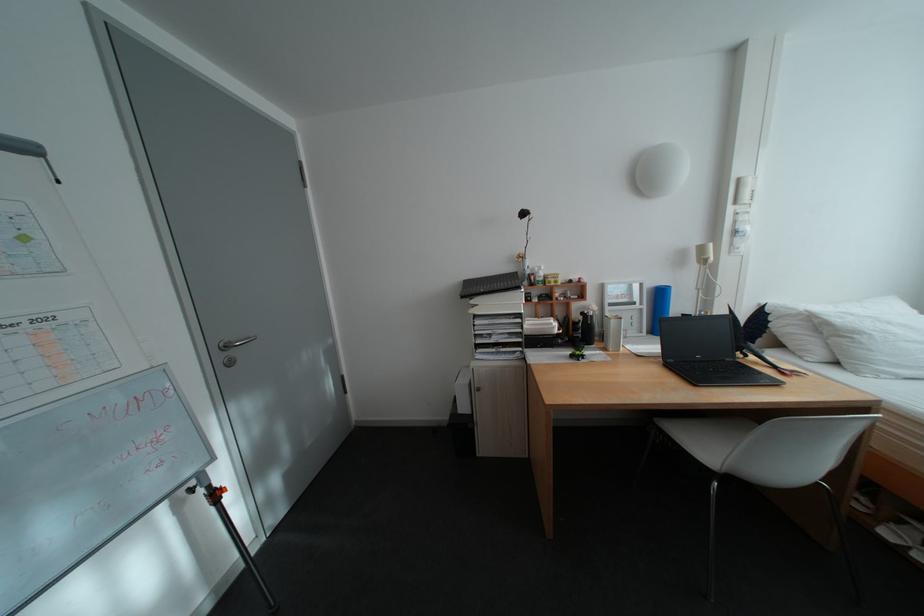
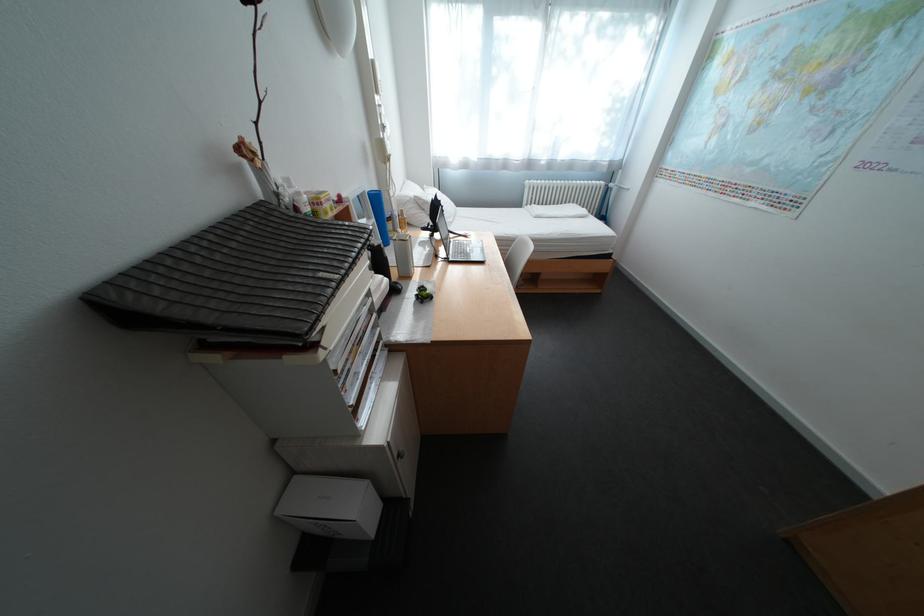
Where in the second image is the point corresponding to pixel 805 313 from the first image?

(420, 200)